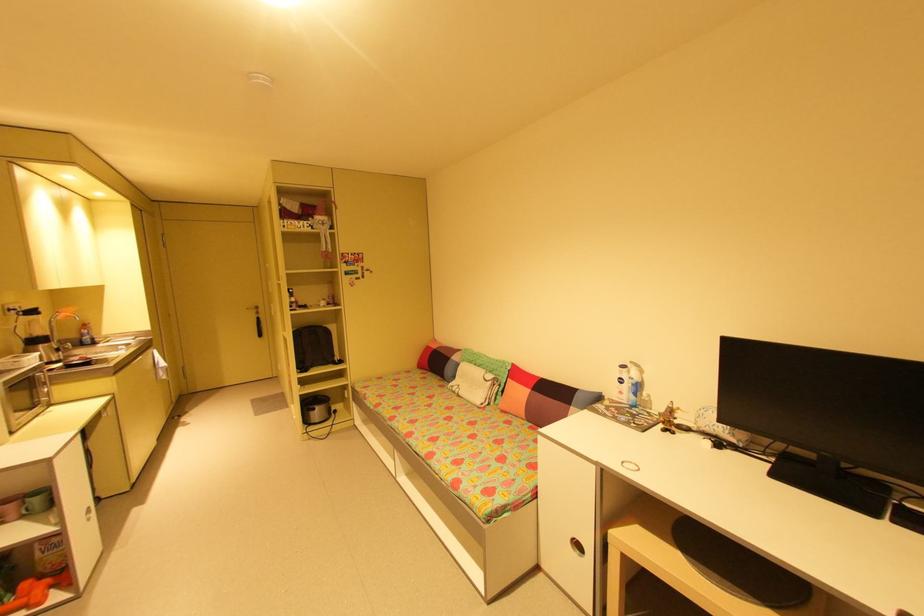
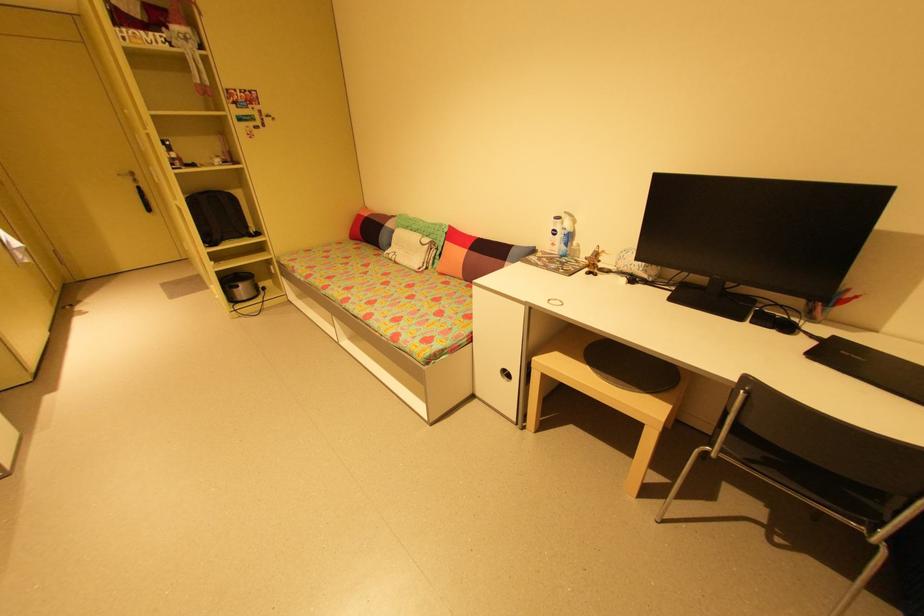
The point at (x=774, y=466) is marked in the first image. Where is the corresponding point in the second image?

(675, 293)